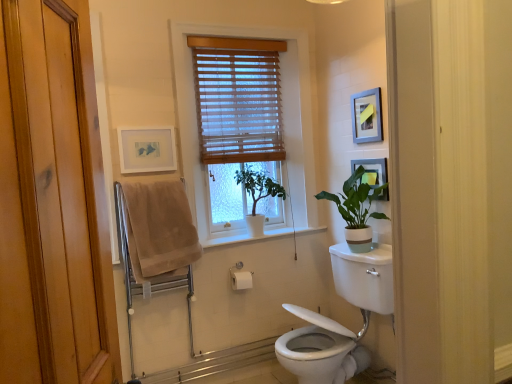
Question: Is matte black picture frame at upper right, which is the 3th picture frame from left to right, located outside wooden blinds at center?

Choices:
 (A) no
 (B) yes

Answer: (B)

Question: Is matte black picture frame at upper right, which is the 3th picture frame from left to right, positioned with its back to wooden blinds at center?

Choices:
 (A) yes
 (B) no

Answer: (B)

Question: Does matte black picture frame at upper right, which is the 3th picture frame from left to right, have a larger size compared to wooden blinds at center?

Choices:
 (A) yes
 (B) no

Answer: (B)

Question: Is matte black picture frame at upper right, placed as the first picture frame when sorted from right to left, facing towards wooden blinds at center?

Choices:
 (A) no
 (B) yes

Answer: (A)

Question: From the image's perspective, does matte black picture frame at upper right, which is the 3th picture frame from left to right, appear lower than wooden blinds at center?

Choices:
 (A) no
 (B) yes

Answer: (B)

Question: Is matte black picture frame at upper right, placed as the first picture frame when sorted from right to left, wider or thinner than matte white picture frame at upper left, the 1th picture frame in the left-to-right sequence?

Choices:
 (A) thin
 (B) wide

Answer: (A)

Question: Is matte black picture frame at upper right, placed as the first picture frame when sorted from right to left, spatially inside matte white picture frame at upper left, the 1th picture frame in the left-to-right sequence, or outside of it?

Choices:
 (A) inside
 (B) outside

Answer: (B)

Question: Considering the positions of point (360, 160) and point (122, 173), is point (360, 160) closer or farther from the camera than point (122, 173)?

Choices:
 (A) closer
 (B) farther

Answer: (B)

Question: Is matte black picture frame at upper right, which is the 3th picture frame from left to right, in front of or behind matte white picture frame at upper left, the 1th picture frame in the left-to-right sequence, in the image?

Choices:
 (A) behind
 (B) front

Answer: (B)

Question: From the image's perspective, is white glossy toilet at lower right above or below wooden blinds at center?

Choices:
 (A) above
 (B) below

Answer: (B)

Question: Is point (332, 322) positioned closer to the camera than point (204, 208)?

Choices:
 (A) closer
 (B) farther

Answer: (A)

Question: Is white glossy toilet at lower right wider or thinner than wooden blinds at center?

Choices:
 (A) thin
 (B) wide

Answer: (B)

Question: Would you say white glossy toilet at lower right is inside or outside wooden blinds at center?

Choices:
 (A) inside
 (B) outside

Answer: (B)

Question: Is green matte plant at center, which appears as the second houseplant when viewed from the right, wider or thinner than silver metallic picture frame at upper right, positioned as the 2th picture frame in left-to-right order?

Choices:
 (A) wide
 (B) thin

Answer: (A)

Question: Is green matte plant at center, the first houseplant positioned from the left, in front of or behind silver metallic picture frame at upper right, the 2th picture frame viewed from the right, in the image?

Choices:
 (A) behind
 (B) front

Answer: (A)